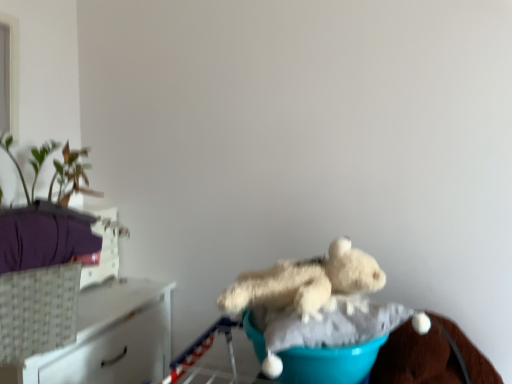
The height and width of the screenshot is (384, 512). What do you see at coordinates (330, 363) in the screenshot?
I see `teal fabric at center` at bounding box center [330, 363].

Identify the location of white woven basket at left. (113, 337).

From the image's perspective, which is below, woven white basket at left or fluffy white teddy bear at center?

woven white basket at left.

Are woven white basket at left and fluffy white teddy bear at center located far from each other?

woven white basket at left is actually quite close to fluffy white teddy bear at center.

This screenshot has width=512, height=384. Find the location of `teddy bear in front of the woven white basket at left`. teddy bear in front of the woven white basket at left is located at coordinates (305, 282).

Is woven white basket at left facing towards fluffy white teddy bear at center?

No, woven white basket at left does not turn towards fluffy white teddy bear at center.

Is fluffy white teddy bear at center at the right side of teal fabric at center?

In fact, fluffy white teddy bear at center is to the left of teal fabric at center.

From a real-world perspective, relative to teal fabric at center, is fluffy white teddy bear at center vertically above or below?

From a real-world perspective, fluffy white teddy bear at center is physically above teal fabric at center.

Considering the sizes of objects fluffy white teddy bear at center and teal fabric at center in the image provided, who is shorter, fluffy white teddy bear at center or teal fabric at center?

With less height is teal fabric at center.

Which is closer to the camera, (319, 299) or (285, 351)?

Point (319, 299) is positioned farther from the camera compared to point (285, 351).

Considering the relative positions of fluffy white teddy bear at center and woven white basket at left in the image provided, is fluffy white teddy bear at center to the right of woven white basket at left from the viewer's perspective?

Indeed, fluffy white teddy bear at center is positioned on the right side of woven white basket at left.

Which object is wider, fluffy white teddy bear at center or woven white basket at left?

fluffy white teddy bear at center.

Is woven white basket at left surrounded by fluffy white teddy bear at center?

No, woven white basket at left is not a part of fluffy white teddy bear at center.

Could you tell me if fluffy white teddy bear at center is facing woven white basket at left?

No, fluffy white teddy bear at center does not turn towards woven white basket at left.

Which is closer to the camera, (145, 368) or (14, 300)?

Point (145, 368) is farther from the camera than point (14, 300).

Between white woven basket at left and woven white basket at left, which one has less height?

woven white basket at left is shorter.

Is white woven basket at left completely or partially outside of woven white basket at left?

white woven basket at left lies outside woven white basket at left's area.

Based on the photo, is the surface of white woven basket at left in direct contact with woven white basket at left?

No, white woven basket at left is not next to woven white basket at left.

Considering the sizes of objects woven white basket at left and white woven basket at left in the image provided, who is bigger, woven white basket at left or white woven basket at left?

With larger size is white woven basket at left.

The height and width of the screenshot is (384, 512). I want to click on furniture below the woven white basket at left (from the image's perspective), so click(113, 337).

Based on the photo, from the image's perspective, is woven white basket at left positioned above or below white woven basket at left?

woven white basket at left is above white woven basket at left.

Which is behind, woven white basket at left or white woven basket at left?

white woven basket at left is further away from the camera.

Does teal fabric at center have a greater width compared to fluffy white teddy bear at center?

Indeed, teal fabric at center has a greater width compared to fluffy white teddy bear at center.

How many degrees apart are the facing directions of teal fabric at center and fluffy white teddy bear at center?

teal fabric at center and fluffy white teddy bear at center are facing 9.62 degrees away from each other.

Between teal fabric at center and fluffy white teddy bear at center, which one has less height?

Standing shorter between the two is teal fabric at center.

From the image's perspective, between teal fabric at center and fluffy white teddy bear at center, who is located below?

From the image's view, teal fabric at center is below.

From the image's perspective, between teal fabric at center and white woven basket at left, which one is located above?

teal fabric at center is shown above in the image.

Considering the points (247, 314) and (100, 353), which point is behind, point (247, 314) or point (100, 353)?

The point (100, 353) is farther.

Between teal fabric at center and white woven basket at left, which one has smaller size?

Smaller between the two is teal fabric at center.

I want to click on teddy bear to the right of woven white basket at left, so click(305, 282).

Where is `teal directly beneath the fluffy white teddy bear at center (from a real-world perspective)`? teal directly beneath the fluffy white teddy bear at center (from a real-world perspective) is located at coordinates (330, 363).

Estimate the real-world distances between objects in this image. Which object is further from fluffy white teddy bear at center, white woven basket at left or woven white basket at left?

Based on the image, white woven basket at left appears to be further to fluffy white teddy bear at center.

When comparing their distances from teal fabric at center, does woven white basket at left or fluffy white teddy bear at center seem closer?

fluffy white teddy bear at center is positioned closer to the anchor teal fabric at center.

Based on their spatial positions, is fluffy white teddy bear at center or white woven basket at left further from woven white basket at left?

The object further to woven white basket at left is fluffy white teddy bear at center.

Considering their positions, is fluffy white teddy bear at center positioned closer to woven white basket at left than teal fabric at center?

Among the two, fluffy white teddy bear at center is located nearer to woven white basket at left.

Based on their spatial positions, is woven white basket at left or fluffy white teddy bear at center further from white woven basket at left?

fluffy white teddy bear at center is positioned further to the anchor white woven basket at left.

Looking at the image, which one is located further to white woven basket at left, fluffy white teddy bear at center or teal fabric at center?

teal fabric at center is positioned further to the anchor white woven basket at left.

Which object lies further to the anchor point fluffy white teddy bear at center, woven white basket at left or teal fabric at center?

Among the two, woven white basket at left is located further to fluffy white teddy bear at center.

Which object lies further to the anchor point teal fabric at center, fluffy white teddy bear at center or woven white basket at left?

Based on the image, woven white basket at left appears to be further to teal fabric at center.

Identify the location of basket between white woven basket at left and teal fabric at center. Image resolution: width=512 pixels, height=384 pixels. (38, 311).

This screenshot has width=512, height=384. I want to click on teddy bear between woven white basket at left and teal fabric at center from left to right, so click(x=305, y=282).

What are the coordinates of `basket between white woven basket at left and fluffy white teddy bear at center in the horizontal direction` in the screenshot? It's located at (38, 311).

Where is `teddy bear located between white woven basket at left and teal fabric at center in the left-right direction`? The height and width of the screenshot is (384, 512). teddy bear located between white woven basket at left and teal fabric at center in the left-right direction is located at coordinates (305, 282).